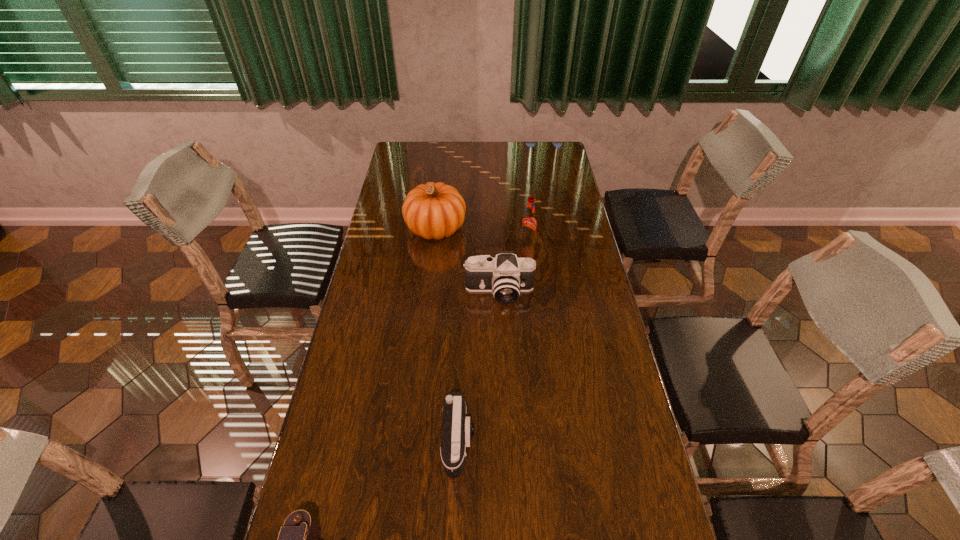
This screenshot has width=960, height=540. Find the location of `pumpkin`. pumpkin is located at coordinates (433, 210).

Where is `root beer`? The width and height of the screenshot is (960, 540). root beer is located at coordinates (529, 221).

Find the location of a particular element. The height and width of the screenshot is (540, 960). the farthest camera is located at coordinates (506, 276).

Identify the location of the tallest camera. The width and height of the screenshot is (960, 540). (506, 276).

I want to click on the second farthest camera, so point(457,430).

Where is `free space located 0.110m on the back of the pumpkin`? free space located 0.110m on the back of the pumpkin is located at coordinates (440, 194).

Locate an element on the screen. This screenshot has width=960, height=540. free spot located on the left of the root beer is located at coordinates (451, 241).

Where is `vacant area located 0.050m on the right of the third tallest object`? The width and height of the screenshot is (960, 540). vacant area located 0.050m on the right of the third tallest object is located at coordinates (549, 292).

Identify the location of free point located 0.390m on the front lens of the second nearest camera. (629, 442).

This screenshot has width=960, height=540. What are the coordinates of `object present at the left edge` in the screenshot? It's located at (433, 210).